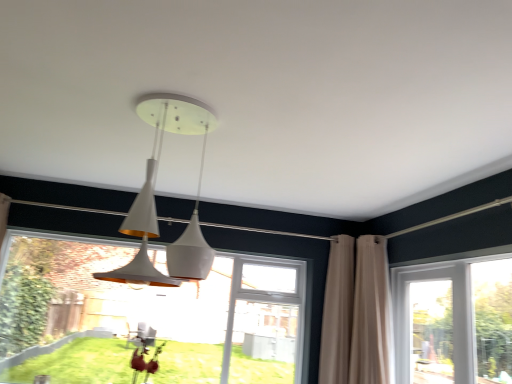
Question: From a real-world perspective, is white glossy pendant light at center physically below transparent glass window at lower left, the 2th window when ordered from right to left?

Choices:
 (A) no
 (B) yes

Answer: (A)

Question: Is white glossy pendant light at center facing towards transparent glass window at lower left, the 2th window when ordered from right to left?

Choices:
 (A) no
 (B) yes

Answer: (A)

Question: Is white glossy pendant light at center far from transparent glass window at lower left, the 2th window when ordered from right to left?

Choices:
 (A) yes
 (B) no

Answer: (A)

Question: Considering the relative sizes of white glossy pendant light at center and transparent glass window at lower left, positioned as the first window in left-to-right order, in the image provided, is white glossy pendant light at center wider than transparent glass window at lower left, positioned as the first window in left-to-right order,?

Choices:
 (A) no
 (B) yes

Answer: (B)

Question: Is white glossy pendant light at center turned away from transparent glass window at lower left, the 2th window when ordered from right to left?

Choices:
 (A) yes
 (B) no

Answer: (A)

Question: Is white glossy pendant light at center to the left or to the right of beige fabric curtain at right, which is the first curtain in left-to-right order, in the image?

Choices:
 (A) left
 (B) right

Answer: (A)

Question: Relative to beige fabric curtain at right, which is the first curtain in left-to-right order, is white glossy pendant light at center in front or behind?

Choices:
 (A) front
 (B) behind

Answer: (A)

Question: Is white glossy pendant light at center wider or thinner than beige fabric curtain at right, arranged as the second curtain when viewed from the right?

Choices:
 (A) thin
 (B) wide

Answer: (B)

Question: From the image's perspective, relative to beige fabric curtain at right, which is the first curtain in left-to-right order, is white glossy pendant light at center above or below?

Choices:
 (A) below
 (B) above

Answer: (B)

Question: From the image's perspective, is beige fabric curtain at right, arranged as the second curtain when viewed from the right, positioned above or below clear glass door at right, positioned as the first window in right-to-left order?

Choices:
 (A) above
 (B) below

Answer: (A)

Question: Is beige fabric curtain at right, which is the first curtain in left-to-right order, spatially inside clear glass door at right, acting as the 2th window starting from the left, or outside of it?

Choices:
 (A) inside
 (B) outside

Answer: (B)

Question: Considering the positions of point (325, 349) and point (430, 357), is point (325, 349) closer or farther from the camera than point (430, 357)?

Choices:
 (A) closer
 (B) farther

Answer: (B)

Question: Visually, is beige fabric curtain at right, arranged as the second curtain when viewed from the right, positioned to the left or to the right of clear glass door at right, positioned as the first window in right-to-left order?

Choices:
 (A) left
 (B) right

Answer: (A)

Question: In terms of width, does transparent glass window at lower left, positioned as the first window in left-to-right order, look wider or thinner when compared to beige fabric curtain at right, which is the first curtain in left-to-right order?

Choices:
 (A) thin
 (B) wide

Answer: (A)

Question: Is transparent glass window at lower left, positioned as the first window in left-to-right order, situated inside beige fabric curtain at right, which is the first curtain in left-to-right order, or outside?

Choices:
 (A) outside
 (B) inside

Answer: (A)